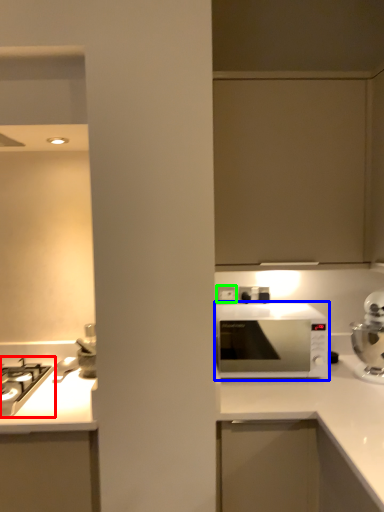
Question: Considering the real-world distances, which object is closest to gas stove (highlighted by a red box)? microwave oven (highlighted by a blue box) or electric outlet (highlighted by a green box).

Choices:
 (A) microwave oven
 (B) electric outlet

Answer: (B)